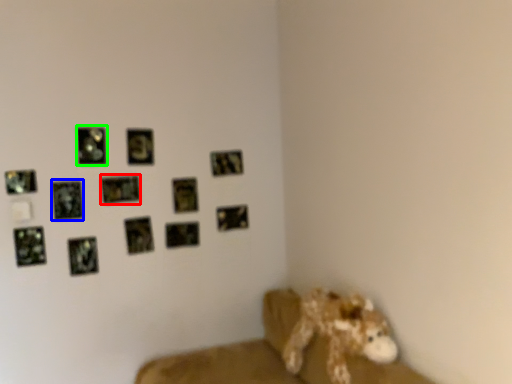
Question: Estimate the real-world distances between objects in this image. Which object is closer to picture frame (highlighted by a red box), picture frame (highlighted by a blue box) or picture frame (highlighted by a green box)?

Choices:
 (A) picture frame
 (B) picture frame

Answer: (B)